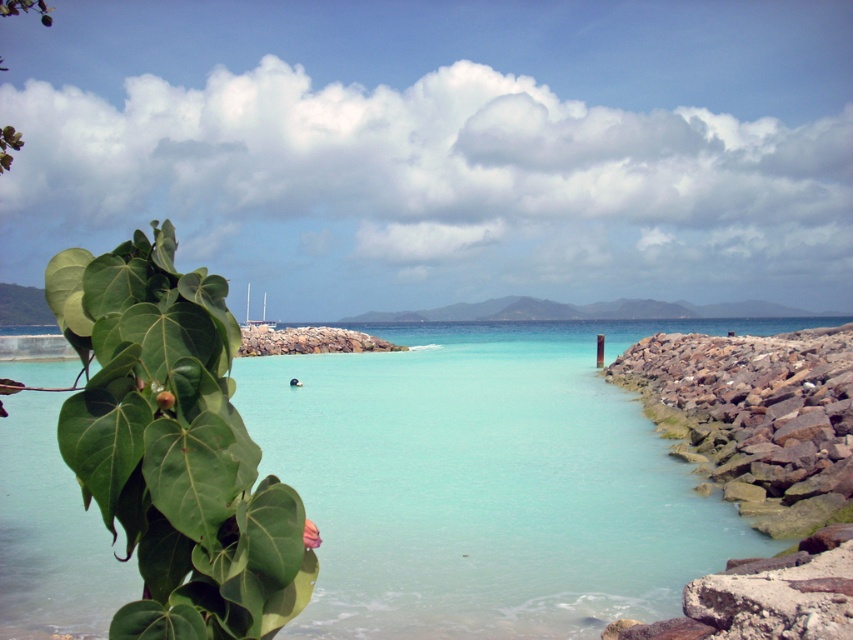
Is clear blue water at center to the right of rockyrough stonerocky barrier at right from the viewer's perspective?

Incorrect, clear blue water at center is not on the right side of rockyrough stonerocky barrier at right.

Between clear blue water at center and rockyrough stonerocky barrier at right, which one appears on the left side from the viewer's perspective?

From the viewer's perspective, clear blue water at center appears more on the left side.

Where is `clear blue water at center`? This screenshot has height=640, width=853. clear blue water at center is located at coordinates (486, 481).